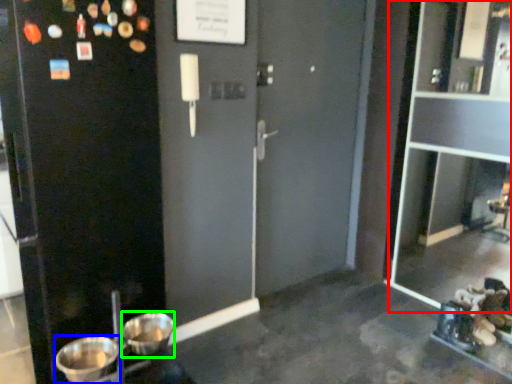
Question: Based on their relative distances, which object is nearer to glass door (highlighted by a red box)? Choose from basin (highlighted by a blue box) and basin (highlighted by a green box).

Choices:
 (A) basin
 (B) basin

Answer: (B)